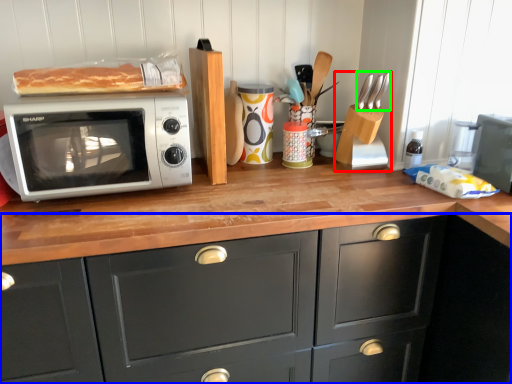
Question: Considering the real-world distances, which object is farthest from appliance (highlighted by a red box)? cabinetry (highlighted by a blue box) or silverware (highlighted by a green box)?

Choices:
 (A) cabinetry
 (B) silverware

Answer: (A)